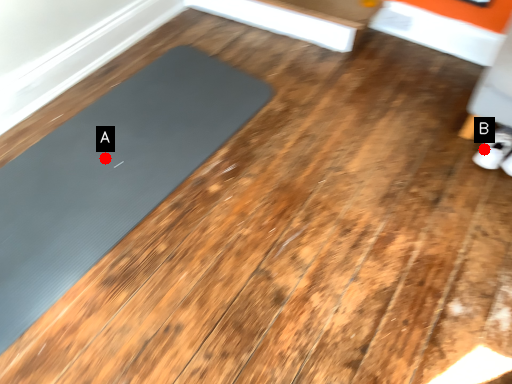
Question: Two points are circled on the image, labeled by A and B beside each circle. Which point is closer to the camera taking this photo?

Choices:
 (A) A is closer
 (B) B is closer

Answer: (A)